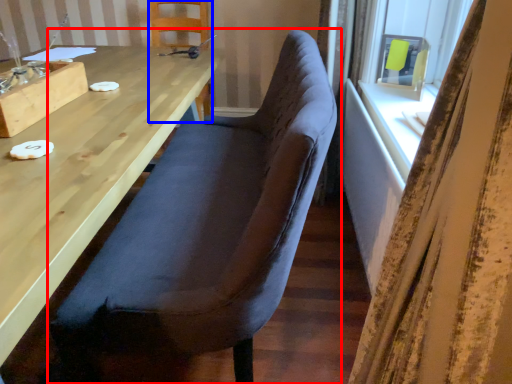
Question: Which object is closer to the camera taking this photo, chair (highlighted by a red box) or chair (highlighted by a blue box)?

Choices:
 (A) chair
 (B) chair

Answer: (A)